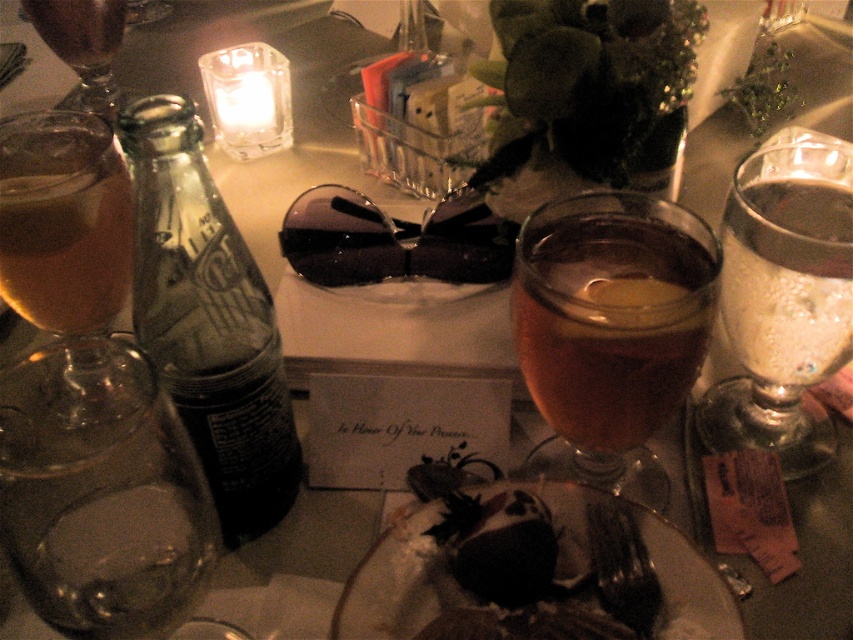
Does black plastic fork at lower center have a greater height compared to dark glass wine at upper left?

Incorrect, black plastic fork at lower center's height is not larger of dark glass wine at upper left's.

Who is positioned more to the right, black plastic fork at lower center or dark glass wine at upper left?

black plastic fork at lower center is more to the right.

Who is more forward, (x=653, y=564) or (x=30, y=4)?

Point (x=653, y=564) is in front.

At what (x,y) coordinates should I click in order to perform the action: click on black plastic fork at lower center. Please return your answer as a coordinate pair (x, y). This screenshot has height=640, width=853. Looking at the image, I should click on (622, 564).

How distant is dark chocolate cake at center from matte glass wine at upper left?

A distance of 55.15 centimeters exists between dark chocolate cake at center and matte glass wine at upper left.

Who is lower down, dark chocolate cake at center or matte glass wine at upper left?

dark chocolate cake at center

Is point (535, 561) positioned before point (83, 92)?

Yes, it is.

I want to click on dark chocolate cake at center, so click(534, 572).

Can you confirm if transparent glass at left is taller than translucent glass wine at left?

No, transparent glass at left is not taller than translucent glass wine at left.

In the scene shown: Is transparent glass at left to the right of translucent glass wine at left from the viewer's perspective?

Indeed, transparent glass at left is positioned on the right side of translucent glass wine at left.

Does point (28, 371) come in front of point (113, 400)?

Yes, it is.

Identify the location of transparent glass at left. (99, 488).